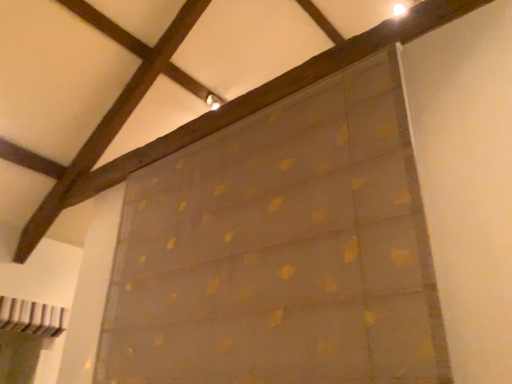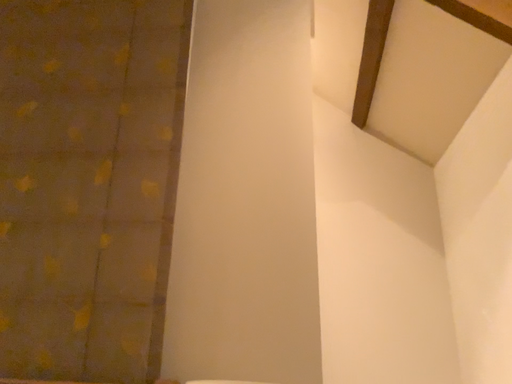
Question: How did the camera likely rotate when shooting the video?

Choices:
 (A) rotated right
 (B) rotated left

Answer: (A)